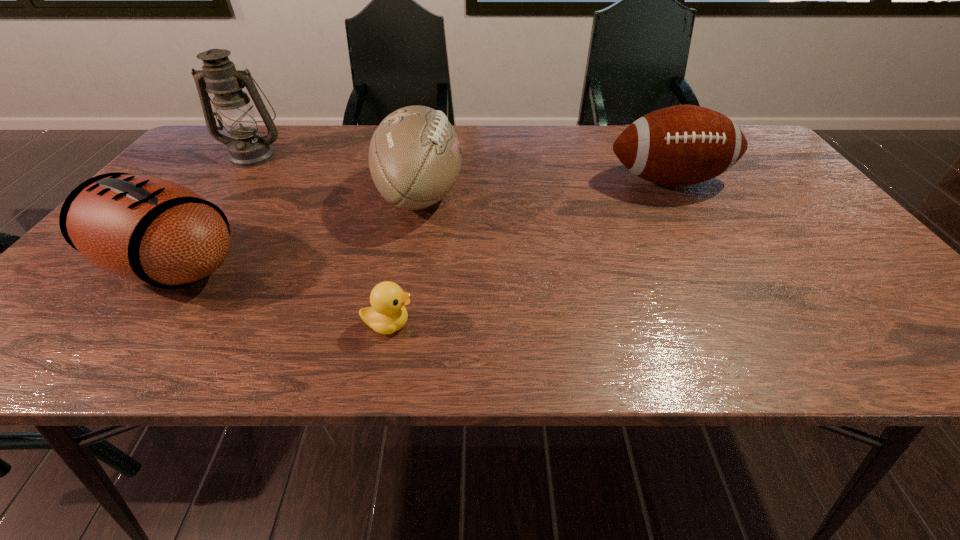
Image resolution: width=960 pixels, height=540 pixels. I want to click on football (American) that is the third closest one to the duck, so click(x=681, y=145).

Find the location of `the closest football (American) to the leftmost football (American)`. the closest football (American) to the leftmost football (American) is located at coordinates (414, 157).

Where is `blank space that satisfies the following two spatial constraints: 1. on the laces of the rightmost object; 2. on the face of the shortest object`? This screenshot has height=540, width=960. blank space that satisfies the following two spatial constraints: 1. on the laces of the rightmost object; 2. on the face of the shortest object is located at coordinates (750, 324).

At what (x,y) coordinates should I click in order to perform the action: click on vacant space that satisfies the following two spatial constraints: 1. on the laces of the rightmost football (American); 2. on the laces of the second football (American) from right to left. Please return your answer as a coordinate pair (x, y). This screenshot has width=960, height=540. Looking at the image, I should click on (676, 195).